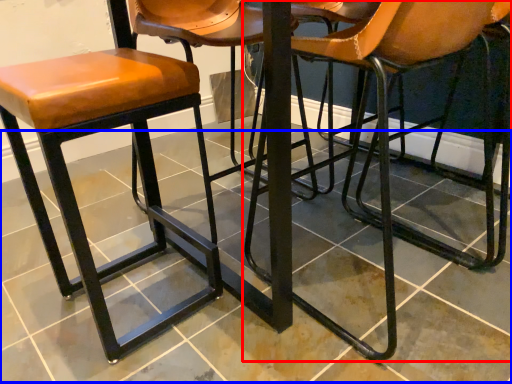
Question: Which object appears closest to the camera in this image, chair (highlighted by a red box) or tile (highlighted by a blue box)?

Choices:
 (A) chair
 (B) tile

Answer: (B)